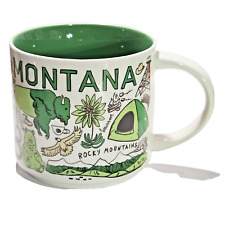
Where is `coffee cup handle`? The width and height of the screenshot is (225, 225). coffee cup handle is located at coordinates (210, 91).